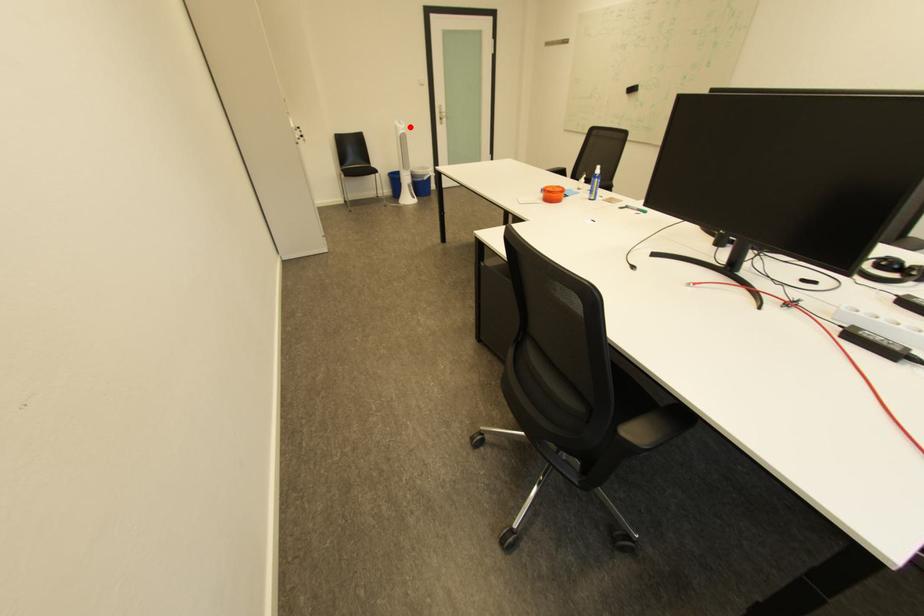
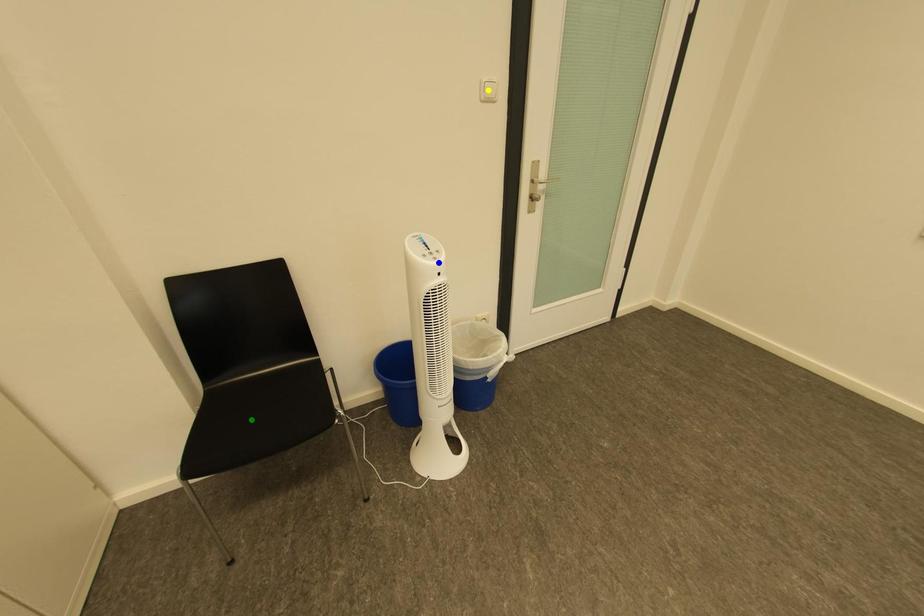
Question: I am providing you with two images of the same scene from different viewpoints. A red point is marked on the first image. You are given multiple points on the second image. Which spot in image 2 lines up with the point in image 1?

Choices:
 (A) blue point
 (B) green point
 (C) yellow point

Answer: (A)